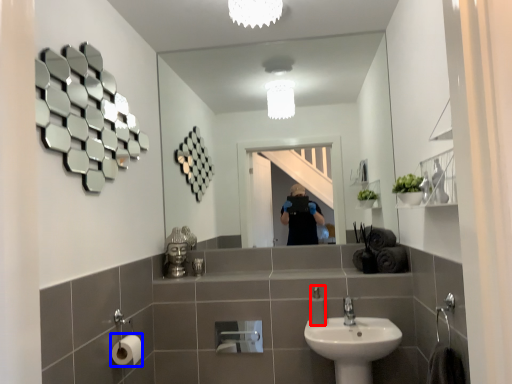
Question: Which of the following is the closest to the observer, soap dispenser (highlighted by a red box) or toilet paper (highlighted by a blue box)?

Choices:
 (A) soap dispenser
 (B) toilet paper

Answer: (B)